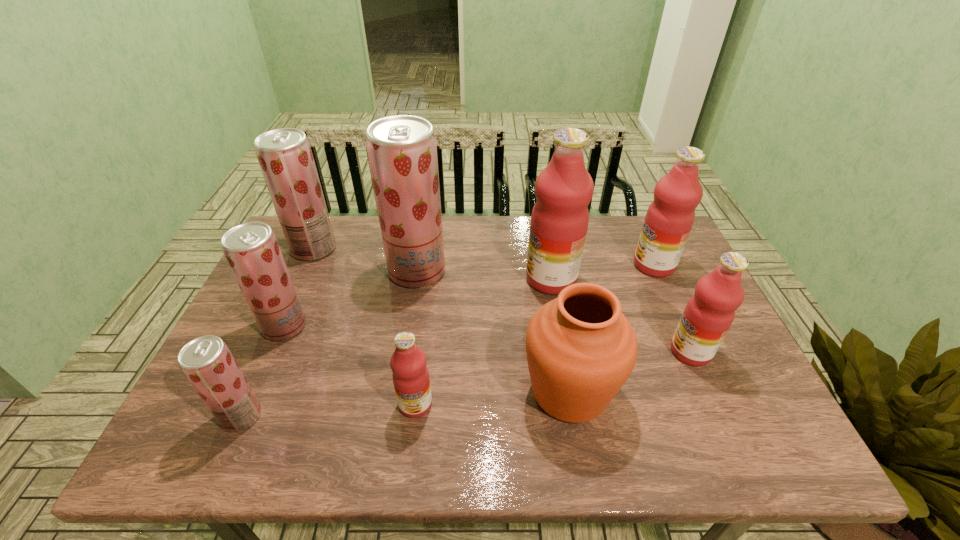
Find the location of `the closest pink fruit juice to the third smallest strawberry fruit juice`. the closest pink fruit juice to the third smallest strawberry fruit juice is located at coordinates (410, 375).

This screenshot has width=960, height=540. Find the location of `pink fruit juice that is the third closest to the biggest strawberry fruit juice`. pink fruit juice that is the third closest to the biggest strawberry fruit juice is located at coordinates (669, 219).

Where is `free space that satisfies the following two spatial constraints: 1. on the label of the sixth fruit juice from left to right; 2. on the label of the leftmost pink fruit juice`? The image size is (960, 540). free space that satisfies the following two spatial constraints: 1. on the label of the sixth fruit juice from left to right; 2. on the label of the leftmost pink fruit juice is located at coordinates (574, 404).

The height and width of the screenshot is (540, 960). Identify the location of vacant point that satisfies the following two spatial constraints: 1. on the label of the third biggest pink fruit juice; 2. on the front side of the smallest strawberry fruit juice. (719, 416).

This screenshot has width=960, height=540. I want to click on vacant point that satisfies the following two spatial constraints: 1. on the front side of the third smallest strawberry fruit juice; 2. on the left side of the biggest strawberry fruit juice, so click(303, 271).